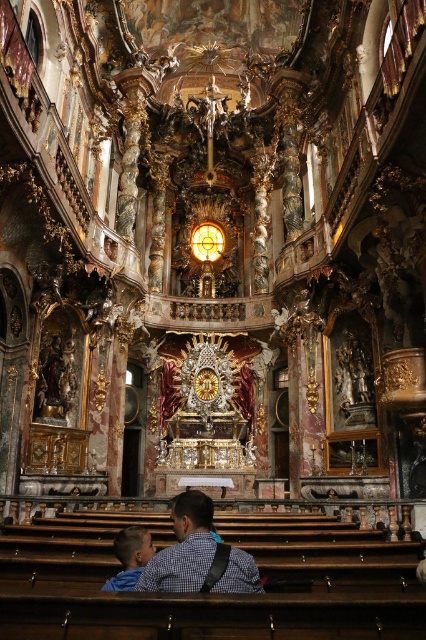
Question: Can you confirm if checkered shirt at lower center is positioned to the left of blue denim jacket at lower left?

Choices:
 (A) yes
 (B) no

Answer: (B)

Question: Can you confirm if checkered shirt at lower center is positioned to the right of blue denim jacket at lower left?

Choices:
 (A) no
 (B) yes

Answer: (B)

Question: Is checkered shirt at lower center to the left of blue denim jacket at lower left from the viewer's perspective?

Choices:
 (A) yes
 (B) no

Answer: (B)